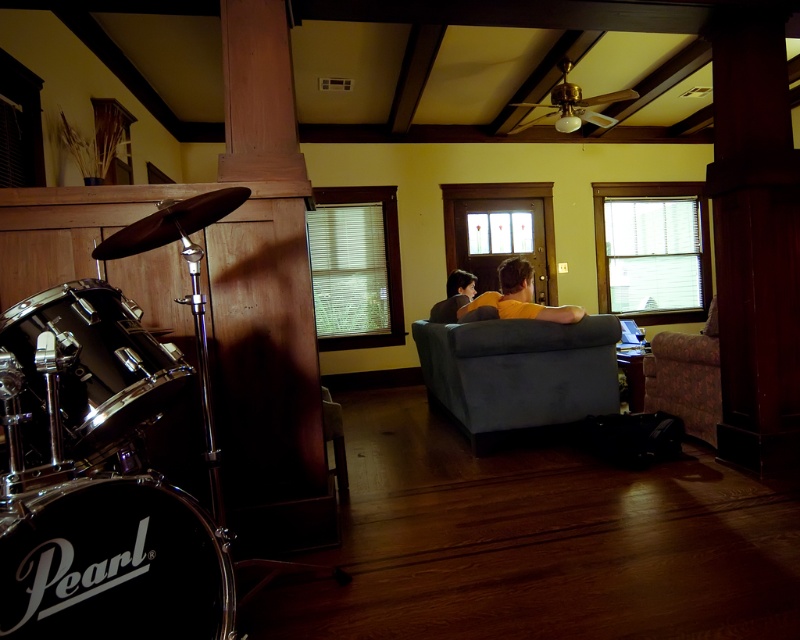
You are planning to move the shiny chrome drum at left into the space currently occupied by the floral fabric couch at right. Based on their sizes, is this feasible?

The shiny chrome drum at left might be wider than the floral fabric couch at right, so moving it might not be feasible due to potential space constraints.